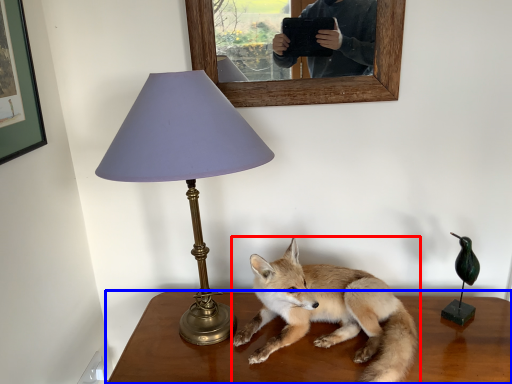
Question: Which object is closer to the camera taking this photo, fox (highlighted by a red box) or table (highlighted by a blue box)?

Choices:
 (A) fox
 (B) table

Answer: (A)